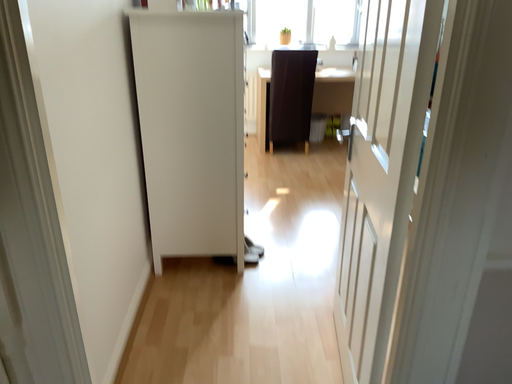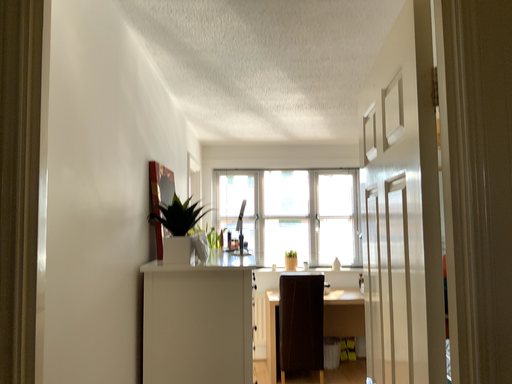
Question: How did the camera likely rotate when shooting the video?

Choices:
 (A) rotated upward
 (B) rotated downward

Answer: (A)